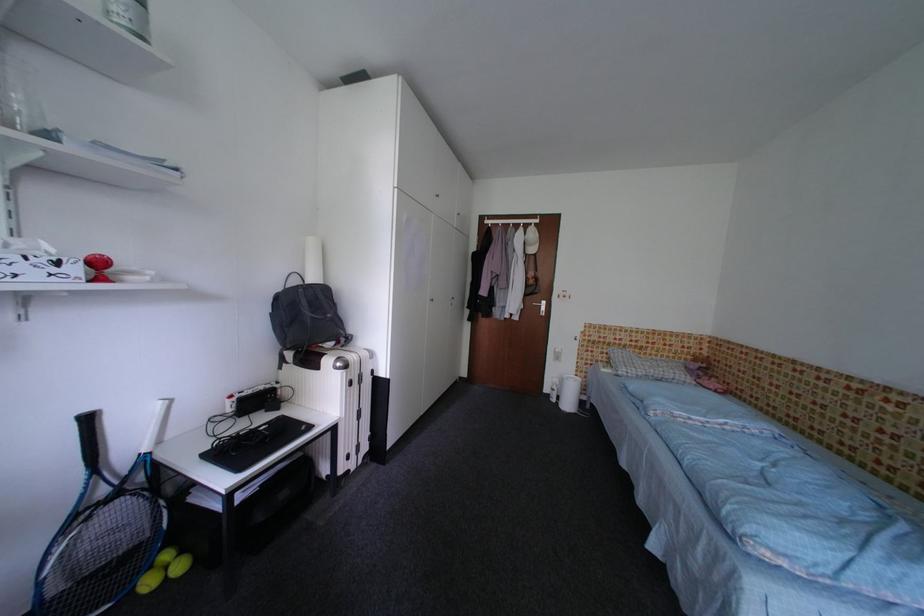
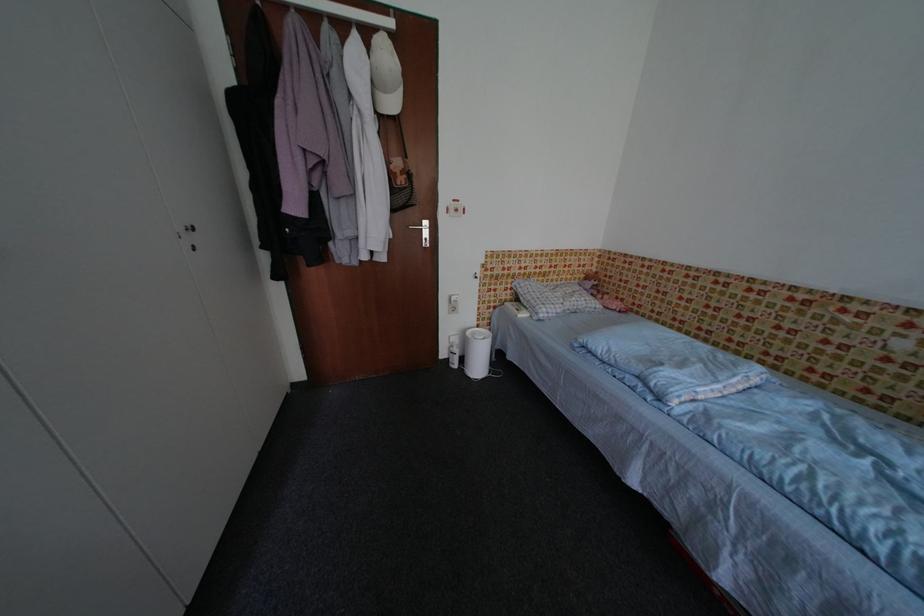
The point at (555, 398) is marked in the first image. Where is the corresponding point in the second image?

(455, 363)